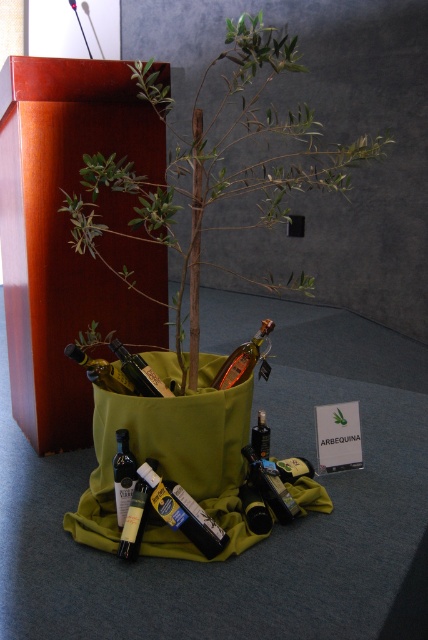
Question: Which point appears closest to the camera in this image?

Choices:
 (A) (113, 468)
 (B) (293, 467)
 (C) (148, 365)

Answer: (A)

Question: Does translucent amber glass bottle at center have a smaller size compared to matte black bottle at center?

Choices:
 (A) no
 (B) yes

Answer: (A)

Question: Can you confirm if translucent amber glass bottle at center is positioned to the left of matte glass bottle at lower left?

Choices:
 (A) yes
 (B) no

Answer: (B)

Question: Can you confirm if translucent amber glass bottle at center is positioned to the left of shiny metallic bottle at center?

Choices:
 (A) no
 (B) yes

Answer: (A)

Question: Among these objects, which one is nearest to the camera?

Choices:
 (A) shiny metallic bottle at center
 (B) dark green glass bottle at lower center

Answer: (B)

Question: Which point appears closest to the camera in this image?

Choices:
 (A) (261, 323)
 (B) (94, 358)
 (C) (83, 244)

Answer: (C)